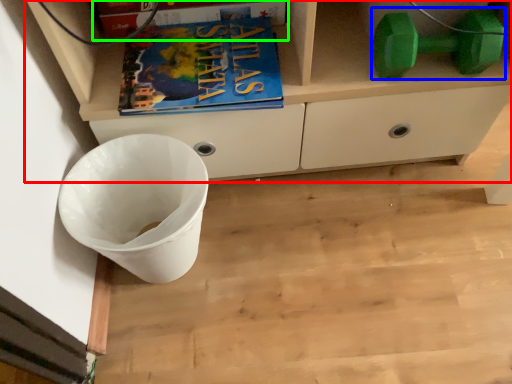
Question: Which object is the closest to the cabinetry (highlighted by a red box)? Choose among these: dumbbell (highlighted by a blue box) or paperback book (highlighted by a green box).

Choices:
 (A) dumbbell
 (B) paperback book

Answer: (A)